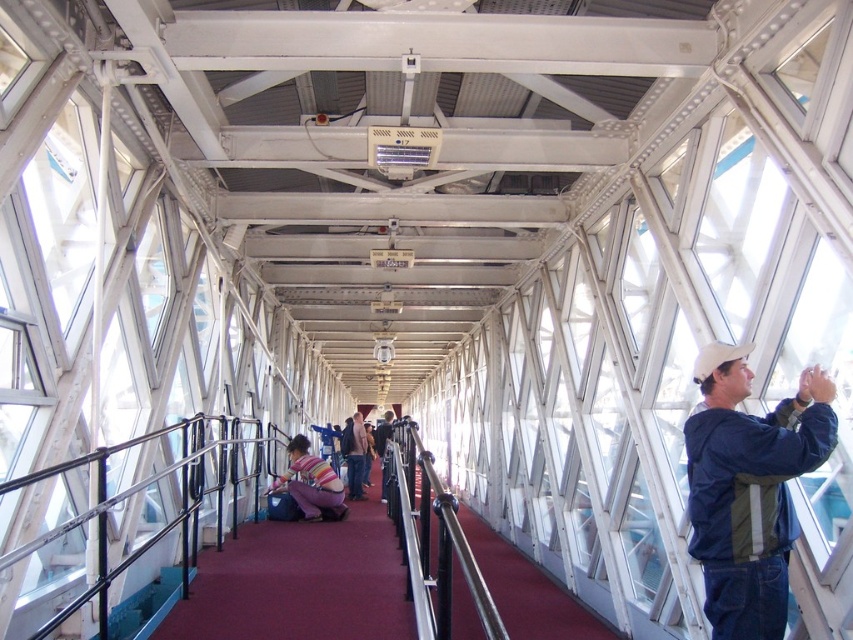
You are a maintenance worker needing to reach the metallic black railing at center for repairs. You have a ladder that is 3 meters long. Can you safely reach the railing with your ladder?

The metallic black railing at center is 3.80 meters away from the viewer. Since the ladder is only 3 meters long, it is not long enough to safely reach the railing. You will need a longer ladder or alternative equipment.

You are standing on the maroon carpet floor in the glass walkway. You see a point marked at coordinates (131, 522). What object is located at that point?

The point at coordinates (131, 522) indicates a metallic black railing at center.